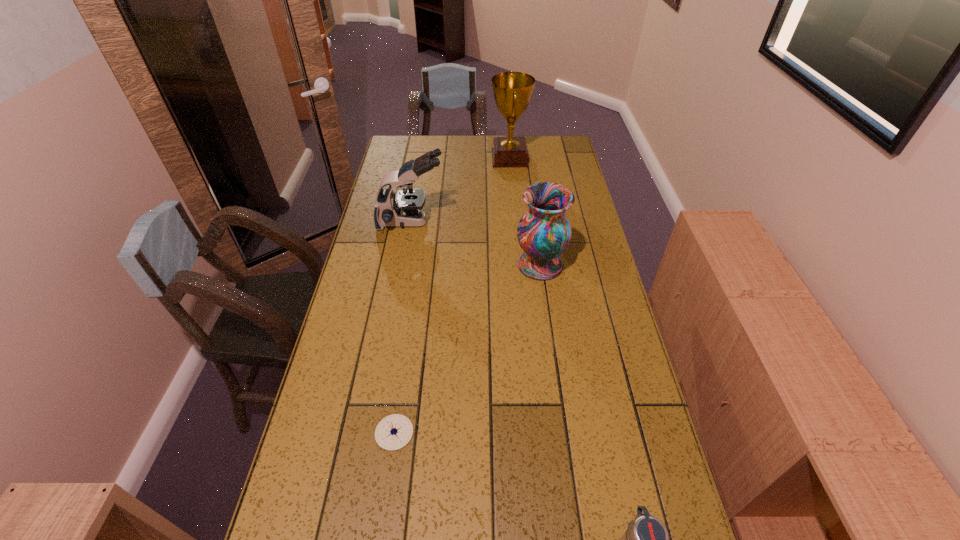
Where is `free point that satisfies the following two spatial constraints: 1. on the back side of the vase; 2. through the eyepieces of the microscope`? free point that satisfies the following two spatial constraints: 1. on the back side of the vase; 2. through the eyepieces of the microscope is located at coordinates (534, 222).

Locate an element on the screen. free point that satisfies the following two spatial constraints: 1. on the plaque of the vase; 2. on the left side of the award is located at coordinates (519, 265).

At what (x,y) coordinates should I click in order to perform the action: click on free location that satisfies the following two spatial constraints: 1. on the back side of the third farthest object; 2. on the left side of the shortest object. Please return your answer as a coordinate pair (x, y). The height and width of the screenshot is (540, 960). Looking at the image, I should click on (419, 265).

Image resolution: width=960 pixels, height=540 pixels. I want to click on free space that satisfies the following two spatial constraints: 1. through the eyepieces of the second farthest object; 2. on the right side of the vase, so click(x=403, y=265).